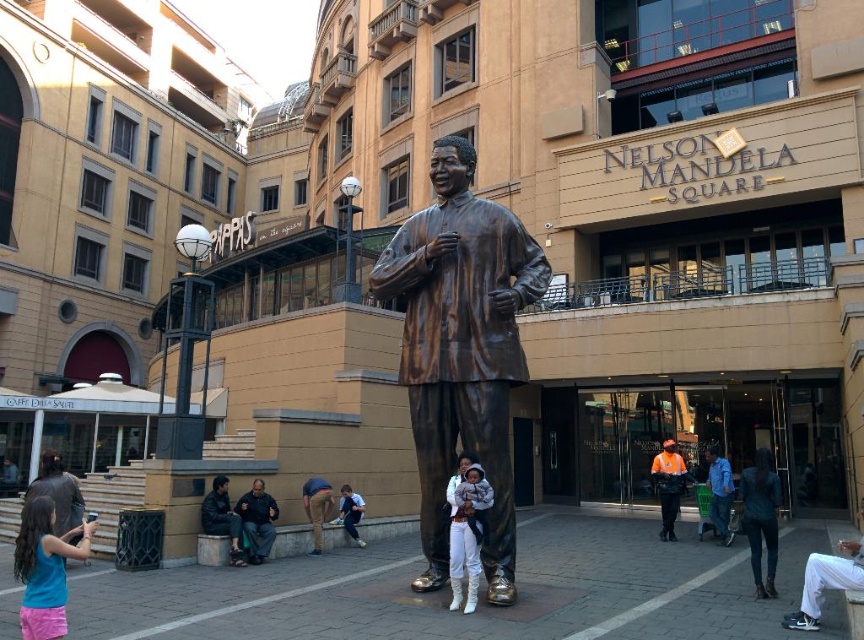
Between white fleece jacket at lower center and leather jacket at lower center, which one is positioned higher?

white fleece jacket at lower center is above.

Does point (480, 541) come in front of point (216, 520)?

Yes, point (480, 541) is in front of point (216, 520).

Is point (454, 508) more distant than point (224, 497)?

No, (454, 508) is in front of (224, 497).

Locate an element on the screen. white fleece jacket at lower center is located at coordinates (467, 529).

Which is above, dark brown leather jacket at lower center or leather jacket at lower center?

dark brown leather jacket at lower center is higher up.

Which of these two, dark brown leather jacket at lower center or leather jacket at lower center, stands shorter?

With less height is dark brown leather jacket at lower center.

Which is behind, point (251, 512) or point (214, 518)?

The point (251, 512) is more distant.

The width and height of the screenshot is (864, 640). I want to click on dark brown leather jacket at lower center, so tap(256, 522).

Is reflective orange vest at center below blue fabric jacket at center?

Yes.

Which is behind, point (665, 522) or point (732, 536)?

Point (665, 522)

Where is `reflective orange vest at center`? The height and width of the screenshot is (640, 864). reflective orange vest at center is located at coordinates (668, 484).

Locate an element on the screen. This screenshot has height=640, width=864. reflective orange vest at center is located at coordinates (668, 484).